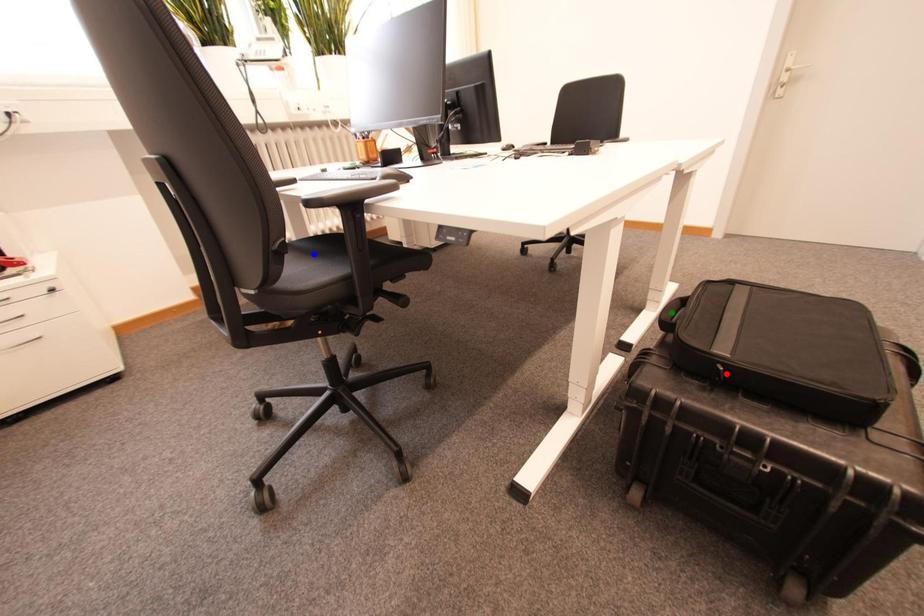
Order these from nearest to farthest:
A) blue point
B) green point
C) red point

red point → blue point → green point